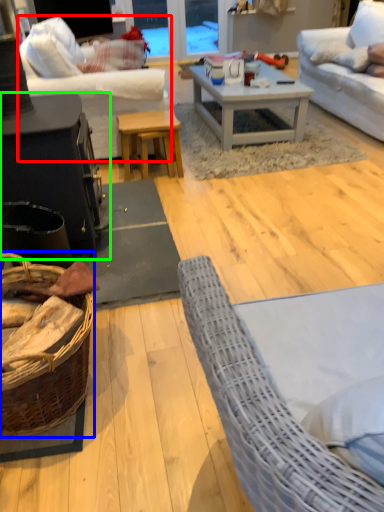
Question: Which object is the closest to the studio couch (highlighted by a red box)? Choose among these: basket (highlighted by a blue box) or table (highlighted by a green box).

Choices:
 (A) basket
 (B) table

Answer: (B)